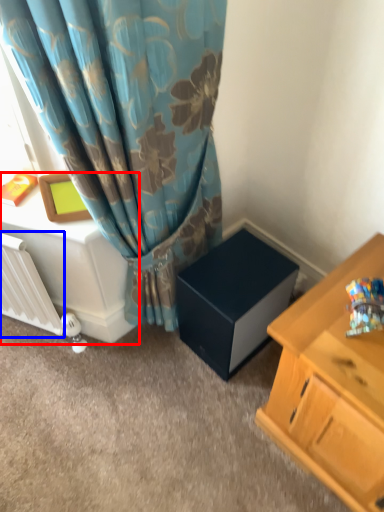
Question: Which object is closer to the camera taking this photo, table (highlighted by a red box) or radiator (highlighted by a blue box)?

Choices:
 (A) table
 (B) radiator

Answer: (B)